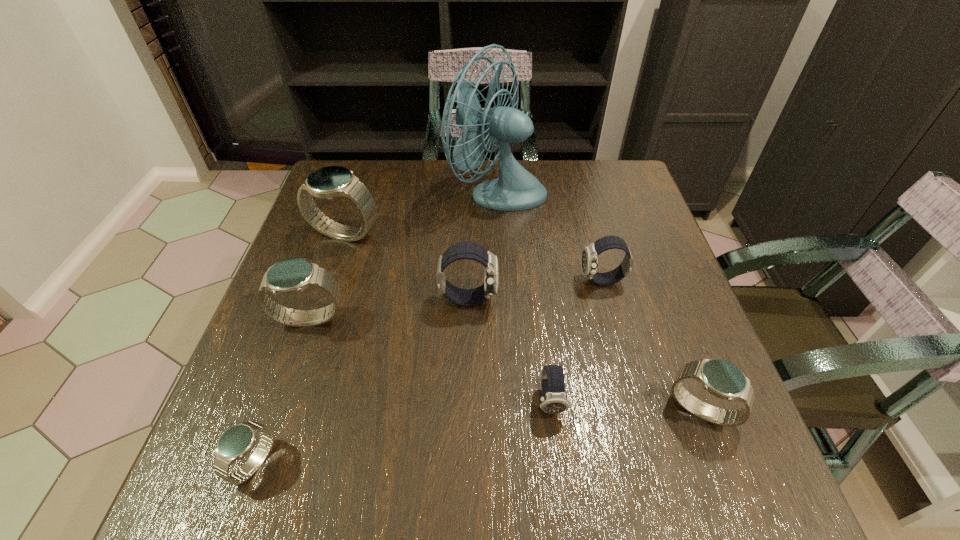
The height and width of the screenshot is (540, 960). Find the location of `vacant space in between the fourth watch from right to left and the fan`. vacant space in between the fourth watch from right to left and the fan is located at coordinates (483, 245).

This screenshot has width=960, height=540. Find the location of `free point between the leftmost dark watch and the second watch from right to left`. free point between the leftmost dark watch and the second watch from right to left is located at coordinates coord(536,289).

You are a GUI agent. You are given a task and a screenshot of the screen. Output one action in this format:
    pyautogui.click(x=<x>, y=<y>)
    Task: Click on the free space between the leftmost dark watch and the third nearest blue watch
    The width and height of the screenshot is (960, 540).
    Given the screenshot: What is the action you would take?
    pyautogui.click(x=389, y=309)

You are a GUI agent. You are given a task and a screenshot of the screen. Output one action in this format:
    pyautogui.click(x=<x>, y=<y>)
    Task: Click on the object that is the fifth closest to the second smallest blue watch
    The image size is (960, 540).
    Given the screenshot: What is the action you would take?
    pyautogui.click(x=290, y=276)

Identify which object is the closest to the rightmost object. Please provide its 2D coordinates. Your answer should be formatted as a tuple, i.e. [(x, y)], where the tuple contains the x and y coordinates of a point satisfying the conditions above.

[(554, 400)]

Find the location of a particular element. the fifth closest watch to the rightmost blue watch is located at coordinates (237, 441).

Locate which watch ranks in proximity to the fourth watch from right to left. Please provide its 2D coordinates. Your answer should be formatted as a tuple, i.e. [(x, y)], where the tuple contains the x and y coordinates of a point satisfying the conditions above.

[(554, 400)]

You are a GUI agent. You are given a task and a screenshot of the screen. Output one action in this format:
    pyautogui.click(x=<x>, y=<y>)
    Task: Click on the blue watch object that ranks as the closest to the leftmost dark watch
    This screenshot has width=960, height=540.
    Given the screenshot: What is the action you would take?
    pyautogui.click(x=290, y=276)

At what (x,y) coordinates should I click in order to perform the action: click on blue watch that can be found as the closest to the nearest dark watch. Please return your answer as a coordinate pair (x, y). Looking at the image, I should click on (721, 378).

I want to click on dark watch that stands as the closest to the tallest object, so click(590, 255).